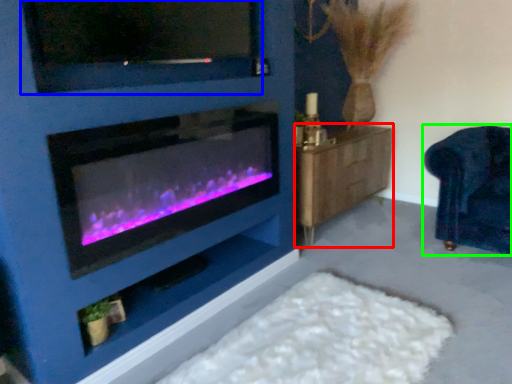
Question: Which is farther away from dresser (highlighted by a red box)? tv show (highlighted by a blue box) or furniture (highlighted by a green box)?

Choices:
 (A) tv show
 (B) furniture

Answer: (A)